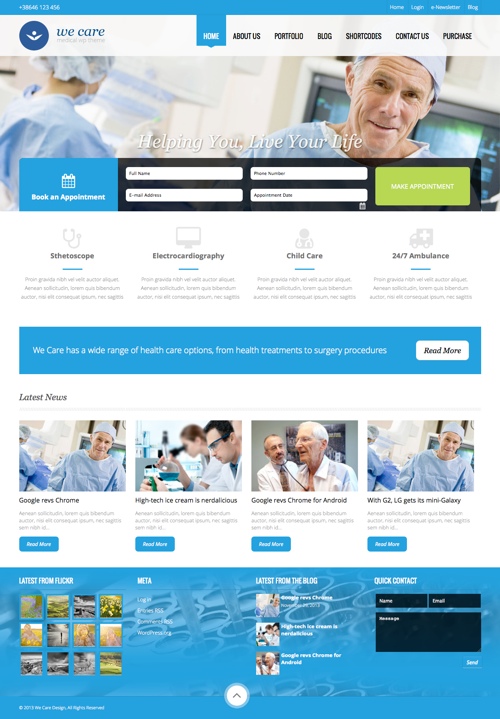
Locate an element on the screen. quick contact form area is located at coordinates (394, 572).